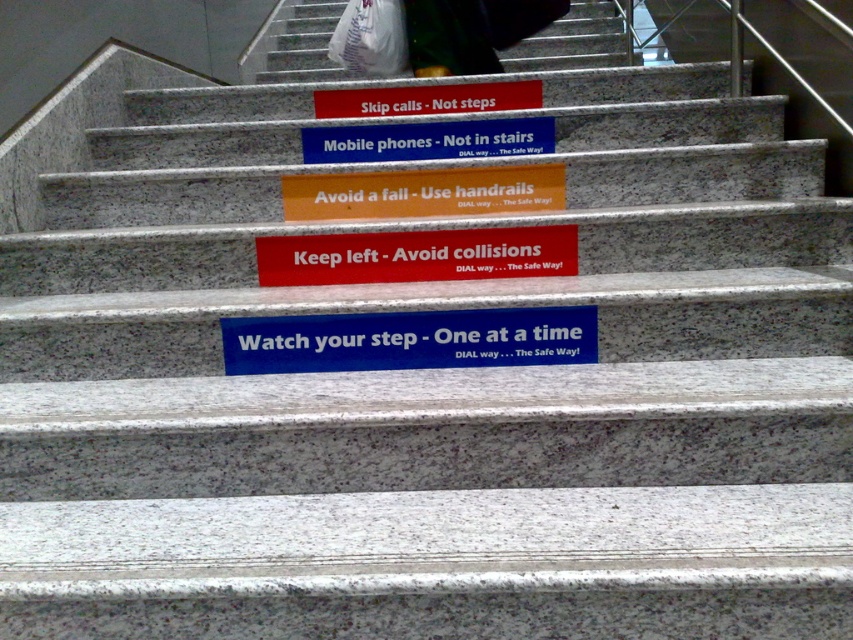
You are standing at the base of the stairs and want to reach the top. If you are exactly 8.43 feet away from the point labeled as point (325, 129), can you estimate whether you are closer to the bottom or the top of the stairs?

The point labeled as point (325, 129) is 8.43 feet away from you. Since you are at the base of the stairs, this distance indicates that you are closer to the bottom of the stairs.

You are an architect designing a similar staircase and want to ensure that the blue plastic sign at center and the matte plastic sign at upper center are visible to people walking up the stairs. Given their sizes, which sign will appear larger to someone looking up from the bottom of the stairs?

The blue plastic sign at center will appear larger because it is much taller than the matte plastic sign at upper center.

You are designing a poster for a school event and need to know which sign has more space for text. The red matte sign at center and the blue plastic sign at center are both available. Which one can accommodate more text without overcrowding?

The red matte sign at center might be wider than blue plastic sign at center, so it can accommodate more text without overcrowding.